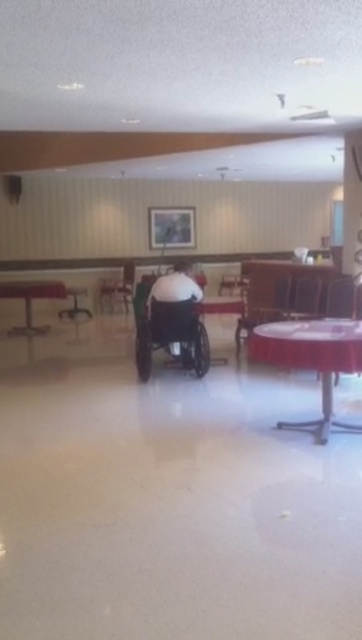
Does green plastic wheelchair at center appear under metallic silver chair at right?

Correct, green plastic wheelchair at center is located below metallic silver chair at right.

Between point (142, 307) and point (297, 289), which one is positioned in front?

Point (142, 307)

Is point (166, 321) more distant than point (314, 289)?

No, it is not.

Image resolution: width=362 pixels, height=640 pixels. Find the location of `green plastic wheelchair at center`. green plastic wheelchair at center is located at coordinates (169, 332).

Between red plastic table at center and metallic silver chair at right, which one has more height?

With more height is red plastic table at center.

Does red plastic table at center have a larger size compared to metallic silver chair at right?

Indeed, red plastic table at center has a larger size compared to metallic silver chair at right.

Which is behind, point (351, 428) or point (302, 307)?

Positioned behind is point (302, 307).

Identify the location of red plastic table at center. (312, 358).

Measure the distance from green plastic wheelchair at center to wooden chair at center.

green plastic wheelchair at center and wooden chair at center are 1.38 meters apart from each other.

Is green plastic wheelchair at center taller than wooden chair at center?

Incorrect, green plastic wheelchair at center's height is not larger of wooden chair at center's.

Is point (175, 330) less distant than point (268, 300)?

That is True.

This screenshot has height=640, width=362. Identify the location of green plastic wheelchair at center. (169, 332).